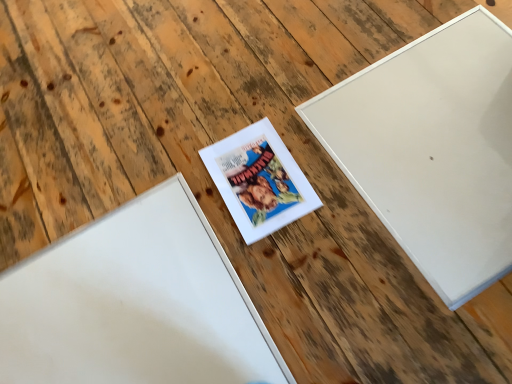
Question: Relative to white matte picture frame at center, positioned as the 2th picture frame in right-to-left order, is white matte picture frame at upper right, which appears as the third picture frame when viewed from the left, in front or behind?

Choices:
 (A) behind
 (B) front

Answer: (B)

Question: Is point (337, 104) closer or farther from the camera than point (238, 163)?

Choices:
 (A) closer
 (B) farther

Answer: (B)

Question: Based on their relative distances, which object is nearer to the white matte picture frame at center, which is the second picture frame from left to right?

Choices:
 (A) white matte picture frame at upper right, arranged as the first picture frame when viewed from the right
 (B) white matte picture frame at center, the 3th picture frame in the right-to-left sequence

Answer: (B)

Question: Estimate the real-world distances between objects in this image. Which object is closer to the white matte picture frame at center, positioned as the 2th picture frame in right-to-left order?

Choices:
 (A) white matte picture frame at center, positioned as the first picture frame in left-to-right order
 (B) white matte picture frame at upper right, arranged as the first picture frame when viewed from the right

Answer: (A)